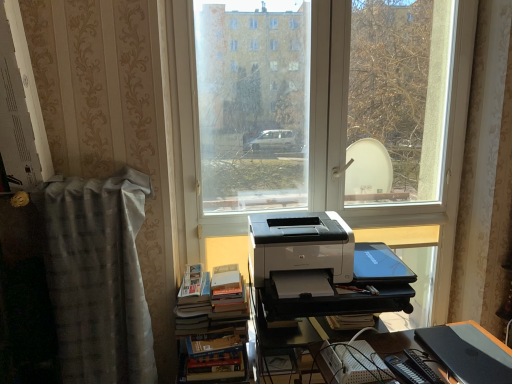
Question: Is black plastic register at lower right, which is counted as the 1th register, starting from the bottom, outside of hardcover book at lower center?

Choices:
 (A) yes
 (B) no

Answer: (A)

Question: Can you confirm if black plastic register at lower right, the second register positioned from the left, is wider than hardcover book at lower center?

Choices:
 (A) no
 (B) yes

Answer: (B)

Question: Considering the relative sizes of black plastic register at lower right, the second register positioned from the top, and hardcover book at lower center in the image provided, is black plastic register at lower right, the second register positioned from the top, shorter than hardcover book at lower center?

Choices:
 (A) no
 (B) yes

Answer: (B)

Question: Is black plastic register at lower right, the second register when ordered from back to front, bigger than hardcover book at lower center?

Choices:
 (A) no
 (B) yes

Answer: (B)

Question: Is hardcover book at lower center inside black plastic register at lower right, positioned as the first register in front-to-back order?

Choices:
 (A) no
 (B) yes

Answer: (A)

Question: Considering the relative sizes of black plastic register at lower right, which is counted as the 1th register, starting from the bottom, and hardcover book at lower center in the image provided, is black plastic register at lower right, which is counted as the 1th register, starting from the bottom, taller than hardcover book at lower center?

Choices:
 (A) no
 (B) yes

Answer: (A)

Question: Would you say hardcover books at center-left is outside white glossy printer at center?

Choices:
 (A) yes
 (B) no

Answer: (A)

Question: From the image's perspective, is hardcover books at center-left below white glossy printer at center?

Choices:
 (A) no
 (B) yes

Answer: (B)

Question: Does hardcover books at center-left appear on the left side of white glossy printer at center?

Choices:
 (A) yes
 (B) no

Answer: (A)

Question: Is hardcover books at center-left bigger than white glossy printer at center?

Choices:
 (A) no
 (B) yes

Answer: (B)

Question: Does hardcover books at center-left have a greater height compared to white glossy printer at center?

Choices:
 (A) yes
 (B) no

Answer: (A)

Question: Could you tell me if hardcover books at center-left is turned towards white glossy printer at center?

Choices:
 (A) yes
 (B) no

Answer: (B)

Question: Is black plastic register at lower right, the second register positioned from the top, surrounded by white glossy printer at center?

Choices:
 (A) yes
 (B) no

Answer: (B)